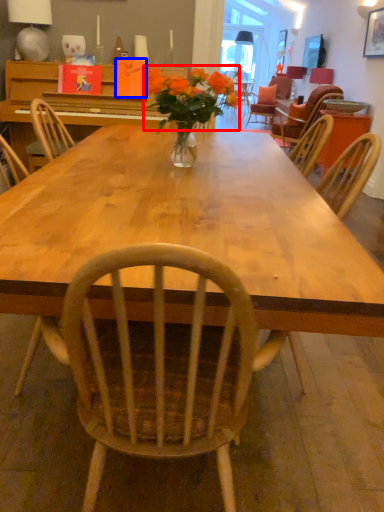
Question: Which object is closer to the camera taking this photo, flower (highlighted by a red box) or book (highlighted by a blue box)?

Choices:
 (A) flower
 (B) book

Answer: (A)